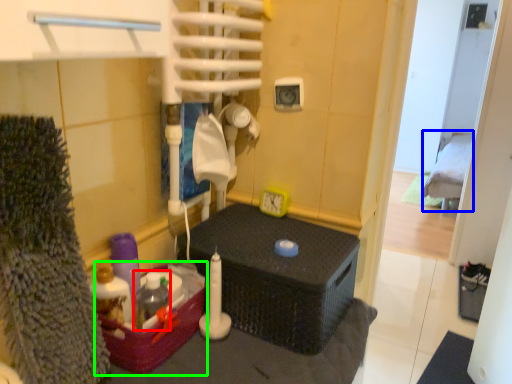
Question: Which object is the farthest from bottle (highlighted by a red box)? Choose among these: bed (highlighted by a blue box) or box (highlighted by a green box).

Choices:
 (A) bed
 (B) box

Answer: (A)